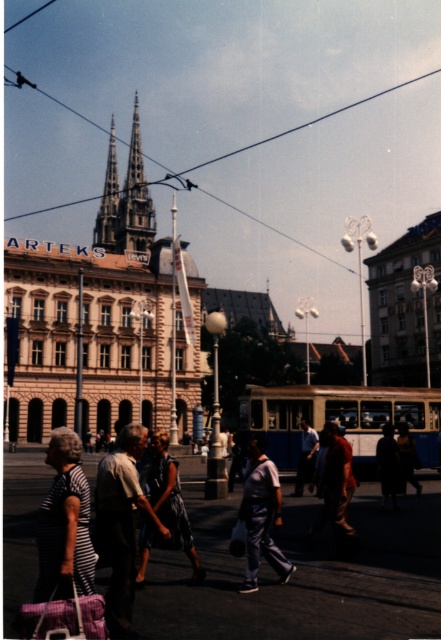
Does dark brown leather jacket at center come behind smooth stone spire at upper center?

No, it is in front of smooth stone spire at upper center.

Between point (324, 428) and point (108, 244), which one is positioned in front?

Point (324, 428) is in front.

The height and width of the screenshot is (640, 441). In order to click on dark brown leather jacket at center in this screenshot , I will do click(336, 486).

Who is lower down, blue denim dress at center or smooth stone spire at upper center?

blue denim dress at center is lower down.

Describe the element at coordinates (167, 509) in the screenshot. I see `blue denim dress at center` at that location.

Is point (178, 483) positioned in front of point (104, 221)?

Yes, point (178, 483) is closer to viewer.

Image resolution: width=441 pixels, height=640 pixels. Identify the location of blue denim dress at center. (167, 509).

Can you confirm if striped fabric people at center is positioned above brown stone spire at upper center?

Incorrect, striped fabric people at center is not positioned above brown stone spire at upper center.

Which is more to the left, striped fabric people at center or brown stone spire at upper center?

Positioned to the left is brown stone spire at upper center.

Is point (302, 616) farther from viewer compared to point (154, 220)?

No, (302, 616) is in front of (154, 220).

At what (x,y) coordinates should I click in order to perform the action: click on striped fabric people at center. Please return your answer as a coordinate pair (x, y). The height and width of the screenshot is (640, 441). Looking at the image, I should click on (283, 577).